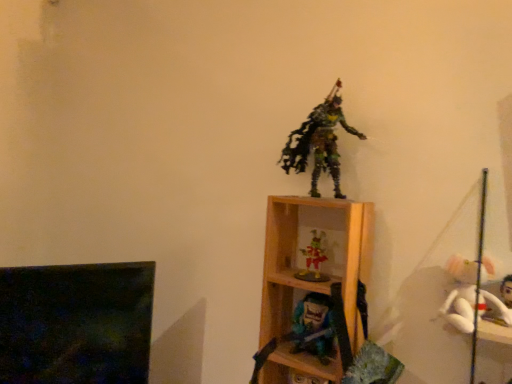
The height and width of the screenshot is (384, 512). Describe the element at coordinates (319, 142) in the screenshot. I see `multicolored plastic figure at center, which is the first toy in top-to-bottom order` at that location.

What do you see at coordinates (314, 326) in the screenshot? I see `matte blue plastic toy at center, marked as the 4th toy in a top-to-bottom arrangement` at bounding box center [314, 326].

The image size is (512, 384). Describe the element at coordinates (468, 298) in the screenshot. I see `white plush at right, which is the second toy from bottom to top` at that location.

At what (x,y) coordinates should I click in order to perform the action: click on shiny plastic figurine at center, the 2th toy positioned from the top. Please return your answer as a coordinate pair (x, y). The height and width of the screenshot is (384, 512). Looking at the image, I should click on (314, 259).

Find the location of a particular element. multicolored plastic figure at center, which is the 4th toy in bottom-to-top order is located at coordinates (319, 142).

Is wooden shelf at center located outside multicolored plastic figure at center, which is the 4th toy in bottom-to-top order?

Yes, wooden shelf at center is not within multicolored plastic figure at center, which is the 4th toy in bottom-to-top order.

Considering the sizes of objects wooden shelf at center and multicolored plastic figure at center, which is the first toy in top-to-bottom order, in the image provided, who is taller, wooden shelf at center or multicolored plastic figure at center, which is the first toy in top-to-bottom order,?

Standing taller between the two is wooden shelf at center.

In the scene shown: Considering the positions of objects wooden shelf at center and multicolored plastic figure at center, which is the first toy in top-to-bottom order, in the image provided, who is more to the left, wooden shelf at center or multicolored plastic figure at center, which is the first toy in top-to-bottom order,?

From the viewer's perspective, wooden shelf at center appears more on the left side.

Based on the photo, from a real-world perspective, is wooden shelf at center above or below multicolored plastic figure at center, which is the first toy in top-to-bottom order?

wooden shelf at center is situated lower than multicolored plastic figure at center, which is the first toy in top-to-bottom order, in the real world.

In order to click on toy to the left of multicolored plastic figure at center, which is the first toy in top-to-bottom order in this screenshot , I will do `click(314, 259)`.

Between multicolored plastic figure at center, which is the 4th toy in bottom-to-top order, and shiny plastic figurine at center, the 2th toy positioned from the top, which one is positioned in front?

multicolored plastic figure at center, which is the 4th toy in bottom-to-top order, is more forward.

Which object is wider, multicolored plastic figure at center, which is the 4th toy in bottom-to-top order, or shiny plastic figurine at center, the 2th toy positioned from the top?

Wider between the two is multicolored plastic figure at center, which is the 4th toy in bottom-to-top order.

Is multicolored plastic figure at center, which is the 4th toy in bottom-to-top order, not close to shiny plastic figurine at center, the third toy from the bottom?

That's not correct — multicolored plastic figure at center, which is the 4th toy in bottom-to-top order, is a little close to shiny plastic figurine at center, the third toy from the bottom.

Could you tell me if wooden shelf at center is turned towards shiny plastic figurine at center, the 2th toy positioned from the top?

Yes.

Is point (362, 278) farther from viewer compared to point (315, 268)?

No, (362, 278) is in front of (315, 268).

Considering the positions of objects wooden shelf at center and shiny plastic figurine at center, the 2th toy positioned from the top, in the image provided, who is in front, wooden shelf at center or shiny plastic figurine at center, the 2th toy positioned from the top,?

wooden shelf at center is in front.

Who is smaller, wooden shelf at center or shiny plastic figurine at center, the third toy from the bottom?

Smaller between the two is shiny plastic figurine at center, the third toy from the bottom.

Does shiny plastic figurine at center, the 2th toy positioned from the top, have a larger size compared to white plush at right, which is the second toy from bottom to top?

No.

Are shiny plastic figurine at center, the 2th toy positioned from the top, and white plush at right, which is the third toy from top to bottom, located far from each other?

That's not correct — shiny plastic figurine at center, the 2th toy positioned from the top, is a little close to white plush at right, which is the third toy from top to bottom.

From a real-world perspective, is shiny plastic figurine at center, the third toy from the bottom, on white plush at right, which is the third toy from top to bottom?

Yes, from a real-world perspective, shiny plastic figurine at center, the third toy from the bottom, is over white plush at right, which is the third toy from top to bottom

Is shiny plastic figurine at center, the third toy from the bottom, facing towards white plush at right, which is the third toy from top to bottom?

No, shiny plastic figurine at center, the third toy from the bottom, is not aimed at white plush at right, which is the third toy from top to bottom.

Is matte blue plastic toy at center, which is the first toy in bottom-to-top order, placed right next to shiny plastic figurine at center, the 2th toy positioned from the top?

No, matte blue plastic toy at center, which is the first toy in bottom-to-top order, is not with shiny plastic figurine at center, the 2th toy positioned from the top.

Considering the points (297, 319) and (316, 256), which point is in front, point (297, 319) or point (316, 256)?

Point (297, 319)

Is matte blue plastic toy at center, which is the first toy in bottom-to-top order, wider than shiny plastic figurine at center, the 2th toy positioned from the top?

No, matte blue plastic toy at center, which is the first toy in bottom-to-top order, is not wider than shiny plastic figurine at center, the 2th toy positioned from the top.

From a real-world perspective, is shiny plastic figurine at center, the 2th toy positioned from the top, on multicolored plastic figure at center, which is the first toy in top-to-bottom order?

No, from a real-world perspective, shiny plastic figurine at center, the 2th toy positioned from the top, is not on top of multicolored plastic figure at center, which is the first toy in top-to-bottom order.

Is shiny plastic figurine at center, the 2th toy positioned from the top, located outside multicolored plastic figure at center, which is the first toy in top-to-bottom order?

Absolutely, shiny plastic figurine at center, the 2th toy positioned from the top, is external to multicolored plastic figure at center, which is the first toy in top-to-bottom order.

Does shiny plastic figurine at center, the third toy from the bottom, have a greater height compared to multicolored plastic figure at center, which is the 4th toy in bottom-to-top order?

No, shiny plastic figurine at center, the third toy from the bottom, is not taller than multicolored plastic figure at center, which is the 4th toy in bottom-to-top order.

From the picture: How far apart are shiny plastic figurine at center, the 2th toy positioned from the top, and multicolored plastic figure at center, which is the first toy in top-to-bottom order?

The distance of shiny plastic figurine at center, the 2th toy positioned from the top, from multicolored plastic figure at center, which is the first toy in top-to-bottom order, is 8.52 inches.

Does point (321, 258) appear closer or farther from the camera than point (305, 302)?

Point (321, 258) is farther from the camera than point (305, 302).

Which object is wider, shiny plastic figurine at center, the third toy from the bottom, or matte blue plastic toy at center, marked as the 4th toy in a top-to-bottom arrangement?

Wider between the two is shiny plastic figurine at center, the third toy from the bottom.

Is shiny plastic figurine at center, the 2th toy positioned from the top, aimed at matte blue plastic toy at center, which is the first toy in bottom-to-top order?

No, shiny plastic figurine at center, the 2th toy positioned from the top, is not oriented towards matte blue plastic toy at center, which is the first toy in bottom-to-top order.

In the scene shown: Is shiny plastic figurine at center, the third toy from the bottom, shorter than matte blue plastic toy at center, marked as the 4th toy in a top-to-bottom arrangement?

Indeed, shiny plastic figurine at center, the third toy from the bottom, has a lesser height compared to matte blue plastic toy at center, marked as the 4th toy in a top-to-bottom arrangement.

The image size is (512, 384). What are the coordinates of `shelf that is in front of the multicolored plastic figure at center, which is the first toy in top-to-bottom order` in the screenshot? It's located at (311, 275).

Image resolution: width=512 pixels, height=384 pixels. Identify the location of toy that appears on the left of multicolored plastic figure at center, which is the first toy in top-to-bottom order. (314, 259).

When comparing their distances from matte blue plastic toy at center, marked as the 4th toy in a top-to-bottom arrangement, does multicolored plastic figure at center, which is the 4th toy in bottom-to-top order, or wooden shelf at center seem closer?

Based on the image, wooden shelf at center appears to be nearer to matte blue plastic toy at center, marked as the 4th toy in a top-to-bottom arrangement.

Based on their spatial positions, is multicolored plastic figure at center, which is the first toy in top-to-bottom order, or white plush at right, which is the third toy from top to bottom, closer to matte blue plastic toy at center, which is the first toy in bottom-to-top order?

Based on the image, white plush at right, which is the third toy from top to bottom, appears to be nearer to matte blue plastic toy at center, which is the first toy in bottom-to-top order.

Which object lies further to the anchor point white plush at right, which is the second toy from bottom to top, shiny plastic figurine at center, the 2th toy positioned from the top, or multicolored plastic figure at center, which is the first toy in top-to-bottom order?

multicolored plastic figure at center, which is the first toy in top-to-bottom order, is positioned further to the anchor white plush at right, which is the second toy from bottom to top.

Based on their spatial positions, is shiny plastic figurine at center, the 2th toy positioned from the top, or white plush at right, which is the second toy from bottom to top, closer to matte blue plastic toy at center, marked as the 4th toy in a top-to-bottom arrangement?

shiny plastic figurine at center, the 2th toy positioned from the top, is closer to matte blue plastic toy at center, marked as the 4th toy in a top-to-bottom arrangement.

When comparing their distances from matte blue plastic toy at center, which is the first toy in bottom-to-top order, does wooden shelf at center or multicolored plastic figure at center, which is the first toy in top-to-bottom order, seem closer?

Based on the image, wooden shelf at center appears to be nearer to matte blue plastic toy at center, which is the first toy in bottom-to-top order.

When comparing their distances from shiny plastic figurine at center, the 2th toy positioned from the top, does white plush at right, which is the third toy from top to bottom, or multicolored plastic figure at center, which is the first toy in top-to-bottom order, seem closer?

multicolored plastic figure at center, which is the first toy in top-to-bottom order, is closer to shiny plastic figurine at center, the 2th toy positioned from the top.

Looking at the image, which one is located closer to white plush at right, which is the third toy from top to bottom, wooden shelf at center or shiny plastic figurine at center, the 2th toy positioned from the top?

wooden shelf at center is positioned closer to the anchor white plush at right, which is the third toy from top to bottom.

When comparing their distances from wooden shelf at center, does shiny plastic figurine at center, the 2th toy positioned from the top, or matte blue plastic toy at center, which is the first toy in bottom-to-top order, seem further?

matte blue plastic toy at center, which is the first toy in bottom-to-top order, is positioned further to the anchor wooden shelf at center.

The height and width of the screenshot is (384, 512). Identify the location of shelf between multicolored plastic figure at center, which is the first toy in top-to-bottom order, and matte blue plastic toy at center, which is the first toy in bottom-to-top order, in the vertical direction. (311, 275).

Identify the location of shelf situated between shiny plastic figurine at center, the third toy from the bottom, and white plush at right, which is the third toy from top to bottom, from left to right. (311, 275).

Image resolution: width=512 pixels, height=384 pixels. I want to click on shelf between shiny plastic figurine at center, the third toy from the bottom, and matte blue plastic toy at center, marked as the 4th toy in a top-to-bottom arrangement, in the up-down direction, so (311, 275).